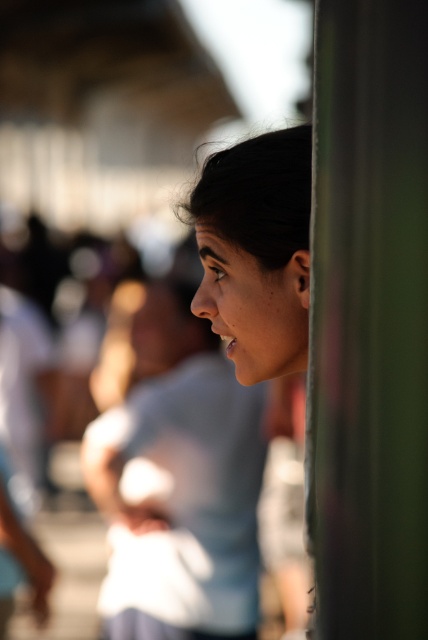
You are a photographer trying to capture a portrait of the smooth skin face at center without the green metallic pole at right appearing too prominent in the frame. Based on their positions, can you adjust your camera angle to make the pole less visible while still keeping the face in focus?

The green metallic pole at right is closer to the viewer than the smooth skin face at center. To minimize the pole in the frame, move the camera position so the angle shifts focus towards the face while keeping it in focus, as the pole is nearer and might block part of the view unless angled sideways.

You are standing at the point marked as point (359,444) in the image. You want to walk to the nearest exit, which is located 65.77 centimeters away from your current position. Considering the scene described, is there any object or structure in your direct path that might block your way?

The distance between your current position at point (359,444) and the nearest exit is 65.77 centimeters. Since the scene description mentions a blurred background with people in a public setting like a street or market, and no specific obstacles are noted in the direct path, it is likely unobstructed. However, the vertical structure mentioned might be between you and the exit. Without explicit details about intervening objects, we can only assume the path is clear based on provided information.

You are a photographer trying to capture a portrait of the smooth skin face at center without the green metallic pole at right appearing in the frame. Based on their relative sizes in the image, can you adjust your camera angle to exclude the pole?

The green metallic pole at right is taller than smooth skin face at center, so by lowering the camera angle to focus on the lower portion of the face, you can exclude the pole from the frame.